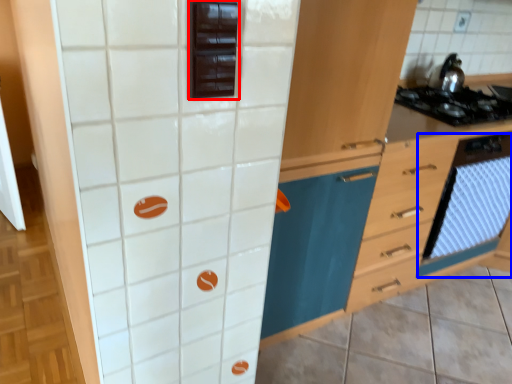
Question: Which point is further to the camera, appliance (highlighted by a red box) or oven (highlighted by a blue box)?

Choices:
 (A) appliance
 (B) oven

Answer: (B)